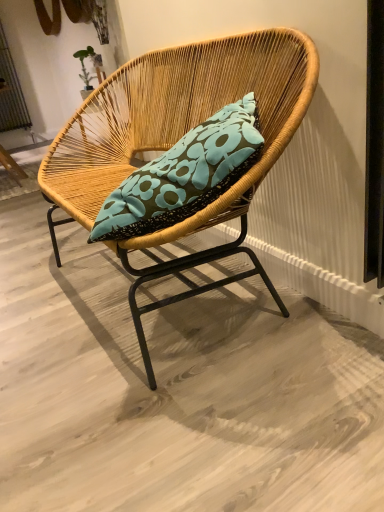
The image size is (384, 512). Identify the location of vacant location below natural woven chair at center (from a real-world perspective). (177, 311).